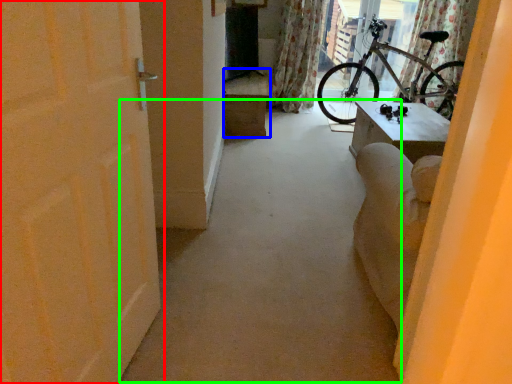
Question: Considering the real-world distances, which object is closest to door (highlighted by a red box)? furniture (highlighted by a blue box) or alley (highlighted by a green box).

Choices:
 (A) furniture
 (B) alley

Answer: (B)